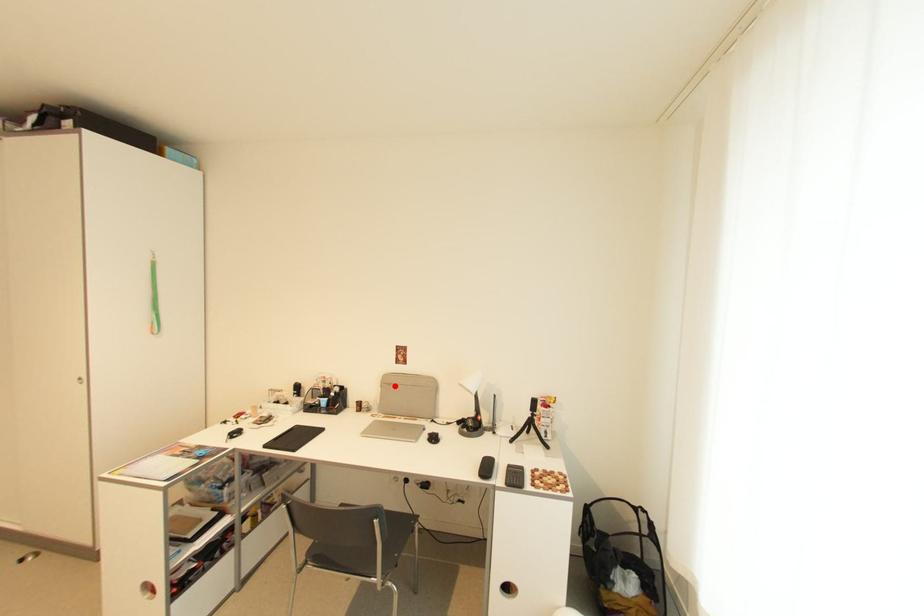
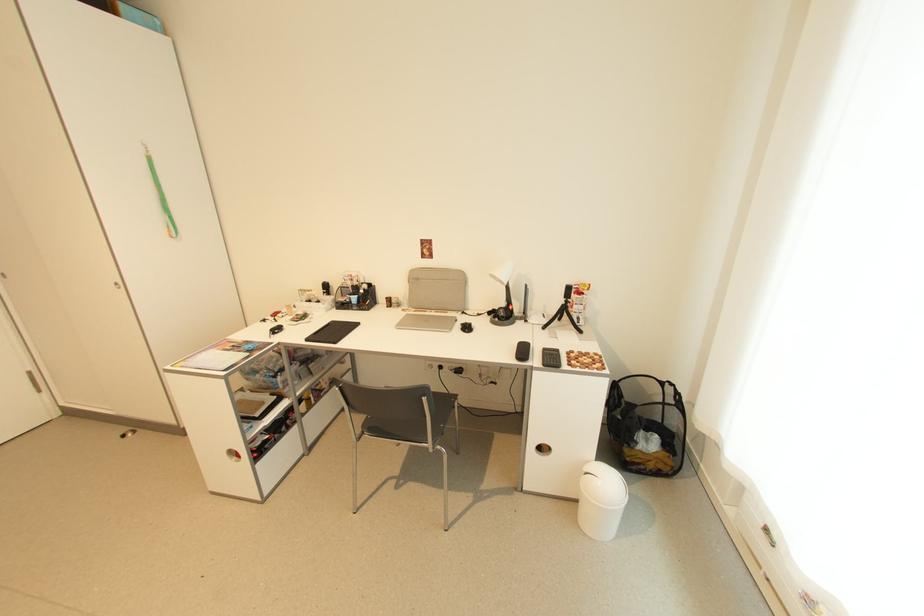
The point at the highlighted location is marked in the first image. Where is the corresponding point in the second image?

(422, 281)